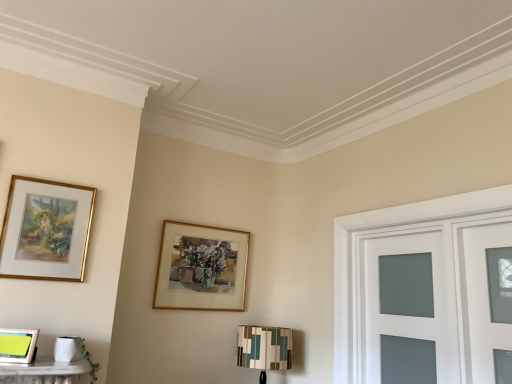
Question: Is gold-framed picture at upper center, the 1th picture frame positioned from the right, taller or shorter than matte glass door at right?

Choices:
 (A) tall
 (B) short

Answer: (B)

Question: Based on their sizes in the image, would you say gold-framed picture at upper center, placed as the third picture frame when sorted from front to back, is bigger or smaller than matte glass door at right?

Choices:
 (A) big
 (B) small

Answer: (B)

Question: Which object is the closest to the gold-framed picture at upper center, placed as the third picture frame when sorted from front to back?

Choices:
 (A) multicolored fabric lampshade at lower right
 (B) gold-framed painting at upper left, the second picture frame positioned from the right
 (C) matte glass door at right
 (D) metallic silver picture frame at lower left, which appears as the 1th picture frame when viewed from the front

Answer: (A)

Question: Considering the real-world distances, which object is closest to the matte glass door at right?

Choices:
 (A) multicolored fabric lampshade at lower right
 (B) gold-framed picture at upper center, placed as the third picture frame when sorted from front to back
 (C) gold-framed painting at upper left, the second picture frame positioned from the right
 (D) metallic silver picture frame at lower left, which appears as the 1th picture frame when viewed from the front

Answer: (A)